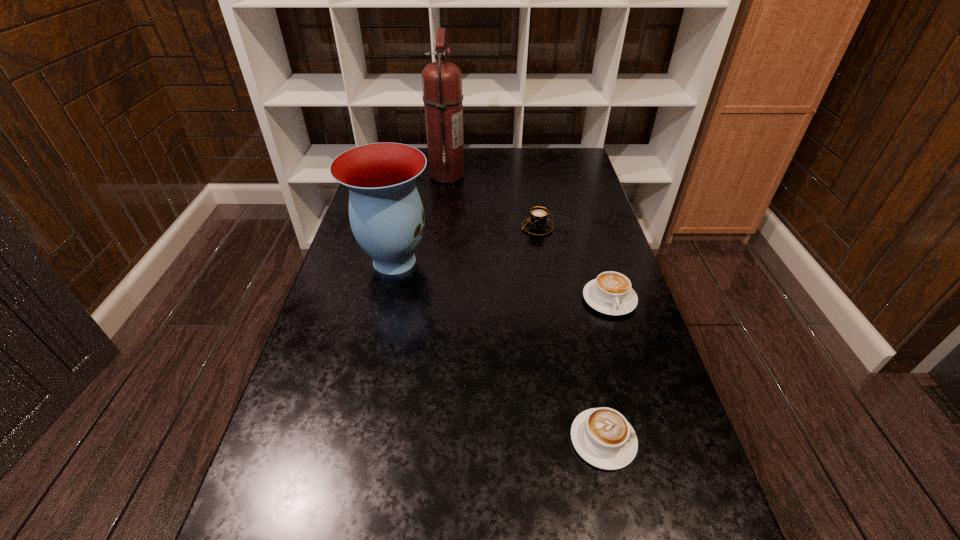
The image size is (960, 540). I want to click on the second closest cappuccino to the farthest object, so click(610, 293).

Where is `vacant area that satisfies the following two spatial constraints: 1. on the front-facing side of the fire extinguisher; 2. on the back side of the farthest cappuccino`? This screenshot has height=540, width=960. vacant area that satisfies the following two spatial constraints: 1. on the front-facing side of the fire extinguisher; 2. on the back side of the farthest cappuccino is located at coordinates (442, 227).

The width and height of the screenshot is (960, 540). Identify the location of blank area in the image that satisfies the following two spatial constraints: 1. on the side of the second farthest cappuccino with the handle; 2. with the handle on the right side of the nearest cappuccino. (653, 440).

Where is `vacant space that satisfies the following two spatial constraints: 1. on the front-facing side of the farthest cappuccino; 2. on the right side of the tallest object`? The height and width of the screenshot is (540, 960). vacant space that satisfies the following two spatial constraints: 1. on the front-facing side of the farthest cappuccino; 2. on the right side of the tallest object is located at coordinates (442, 227).

Find the location of a particular element. This screenshot has width=960, height=540. vacant space that satisfies the following two spatial constraints: 1. on the back side of the farthest cappuccino; 2. on the left side of the vase is located at coordinates (402, 227).

Find the location of a particular element. free space that satisfies the following two spatial constraints: 1. on the side of the second farthest cappuccino with the handle; 2. with the handle on the right side of the nearest object is located at coordinates (653, 440).